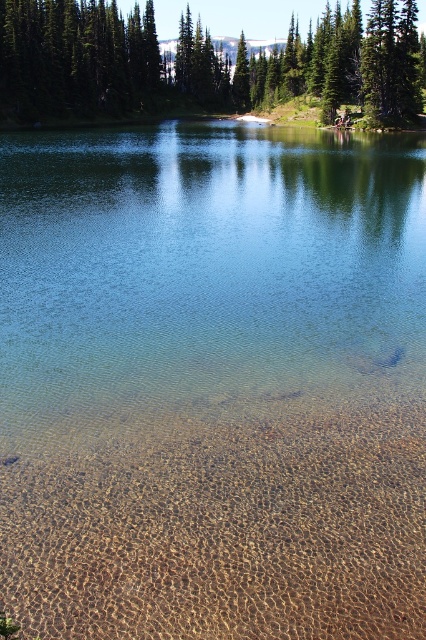
You are an environmental scientist assessing the lake. You observe the clear water at center and the green matte tree at upper center. Which object occupies a larger area in the image?

The green matte tree at upper center occupies a larger area in the image than the clear water at center, as the clear water at center has a smaller size compared to the green matte tree at upper center.

You are standing on the clear sand at bottom and want to reach the water. According to the coordinates provided, in which direction should you move to reach the water?

The clear sand at bottom is located at coordinates point (224, 529). Since the water is in the center of the image, you should move towards the center direction to reach the water.